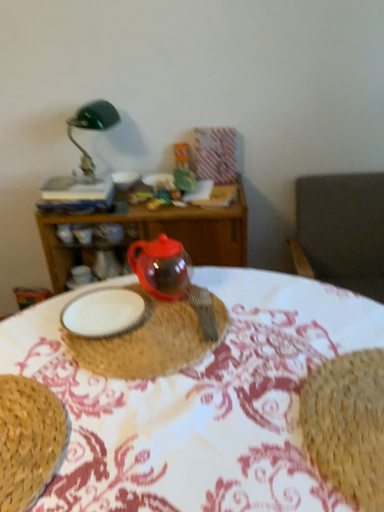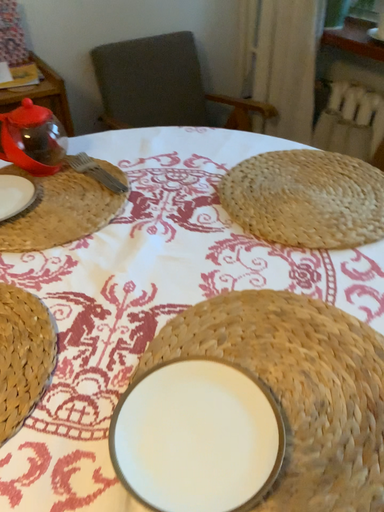
Question: Which way did the camera rotate in the video?

Choices:
 (A) rotated upward
 (B) rotated downward

Answer: (B)